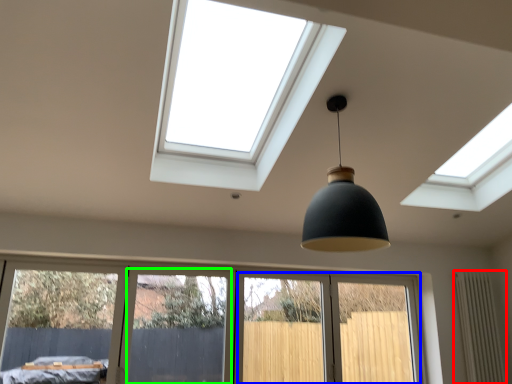
Question: Which is nearer to the radiator (highlighted by a red box)? screen door (highlighted by a blue box) or screen door (highlighted by a green box).

Choices:
 (A) screen door
 (B) screen door

Answer: (A)